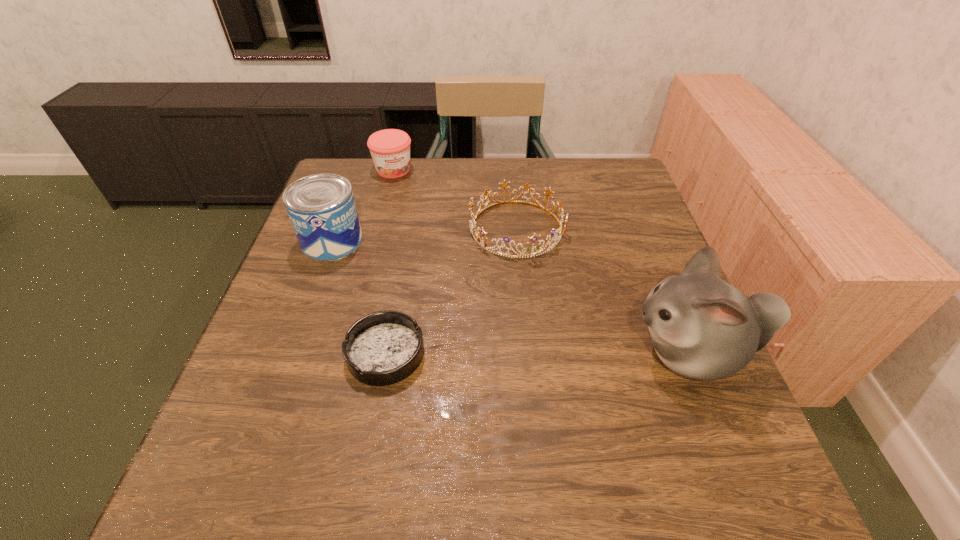
Locate an element on the screen. The height and width of the screenshot is (540, 960). vacant space that satisfies the following two spatial constraints: 1. on the front side of the can; 2. on the right side of the shortest object is located at coordinates (292, 354).